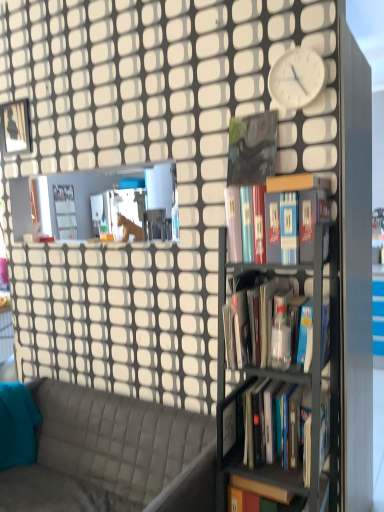
Question: Is the depth of metallic gray bookshelf at right less than that of hardcover books at center, the 4th book in the top-to-bottom sequence?

Choices:
 (A) no
 (B) yes

Answer: (B)

Question: Is metallic gray bookshelf at right not within hardcover books at center, positioned as the first book in bottom-to-top order?

Choices:
 (A) yes
 (B) no

Answer: (A)

Question: Can you confirm if metallic gray bookshelf at right is wider than hardcover books at center, positioned as the first book in bottom-to-top order?

Choices:
 (A) no
 (B) yes

Answer: (B)

Question: Is metallic gray bookshelf at right with hardcover books at center, the 4th book in the top-to-bottom sequence?

Choices:
 (A) no
 (B) yes

Answer: (A)

Question: From the image's perspective, is metallic gray bookshelf at right over hardcover books at center, positioned as the first book in bottom-to-top order?

Choices:
 (A) yes
 (B) no

Answer: (A)

Question: Is metallic gray bookshelf at right looking in the opposite direction of hardcover books at center, positioned as the first book in bottom-to-top order?

Choices:
 (A) no
 (B) yes

Answer: (B)

Question: Is teal fabric pillow at left further to the viewer compared to black matte book at center, placed as the 4th book when sorted from bottom to top?

Choices:
 (A) yes
 (B) no

Answer: (A)

Question: Considering the relative sizes of teal fabric pillow at left and black matte book at center, which appears as the 1th book when viewed from the top, in the image provided, is teal fabric pillow at left shorter than black matte book at center, which appears as the 1th book when viewed from the top,?

Choices:
 (A) yes
 (B) no

Answer: (B)

Question: Could you tell me if teal fabric pillow at left is turned towards black matte book at center, which appears as the 1th book when viewed from the top?

Choices:
 (A) no
 (B) yes

Answer: (A)

Question: Can you confirm if teal fabric pillow at left is positioned to the left of black matte book at center, placed as the 4th book when sorted from bottom to top?

Choices:
 (A) no
 (B) yes

Answer: (B)

Question: Would you say black matte book at center, placed as the 4th book when sorted from bottom to top, is part of teal fabric pillow at left's contents?

Choices:
 (A) yes
 (B) no

Answer: (B)

Question: From a real-world perspective, is teal fabric pillow at left under black matte book at center, placed as the 4th book when sorted from bottom to top?

Choices:
 (A) yes
 (B) no

Answer: (A)

Question: Is metallic gray bookshelf at right not inside white matte clock at upper right?

Choices:
 (A) no
 (B) yes

Answer: (B)